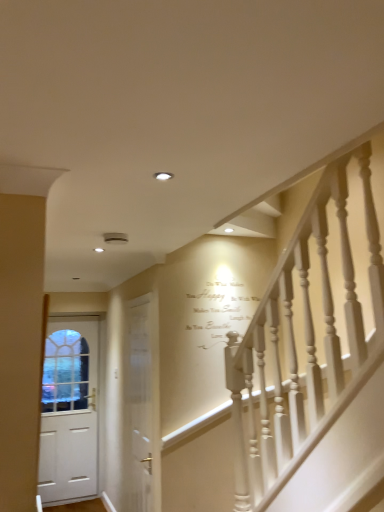
What are the coordinates of `white matte door at left, the 1th door positioned from the back` in the screenshot? It's located at (69, 411).

The height and width of the screenshot is (512, 384). What do you see at coordinates (69, 411) in the screenshot?
I see `white matte door at left, the 2th door in the right-to-left sequence` at bounding box center [69, 411].

What do you see at coordinates (140, 404) in the screenshot?
I see `white wooden door at center, which appears as the first door when viewed from the right` at bounding box center [140, 404].

This screenshot has width=384, height=512. I want to click on white wooden door at center, which is the first door from front to back, so (140, 404).

What are the coordinates of `white matte door at left, which is the 2th door from front to back` in the screenshot? It's located at (69, 411).

Between white wooden door at center, which is the first door from front to back, and white matte door at left, the 2th door in the right-to-left sequence, which one appears on the right side from the viewer's perspective?

white wooden door at center, which is the first door from front to back.

Is white wooden door at center, which is the first door from front to back, further to the viewer compared to white matte door at left, the 2th door in the right-to-left sequence?

No, it is in front of white matte door at left, the 2th door in the right-to-left sequence.

Considering the positions of points (133, 438) and (82, 348), is point (133, 438) closer to camera compared to point (82, 348)?

Yes, it is in front of point (82, 348).

From the image's perspective, is white wooden door at center, which appears as the first door when viewed from the right, on top of white matte door at left, the 1th door when ordered from left to right?

Yes.

From a real-world perspective, is white wooden door at center, which ranks as the 2th door in left-to-right order, physically located above or below white matte door at left, which is the 2th door from front to back?

Clearly, from a real-world perspective, white wooden door at center, which ranks as the 2th door in left-to-right order, is above white matte door at left, which is the 2th door from front to back.

Can you confirm if white wooden door at center, which appears as the first door when viewed from the right, is wider than white matte door at left, the 2th door in the right-to-left sequence?

In fact, white wooden door at center, which appears as the first door when viewed from the right, might be narrower than white matte door at left, the 2th door in the right-to-left sequence.

Who is shorter, white wooden door at center, which is the first door from front to back, or white matte door at left, the 1th door when ordered from left to right?

With less height is white wooden door at center, which is the first door from front to back.

Considering the sizes of objects white wooden door at center, which appears as the first door when viewed from the right, and white matte door at left, the 2th door in the right-to-left sequence, in the image provided, who is smaller, white wooden door at center, which appears as the first door when viewed from the right, or white matte door at left, the 2th door in the right-to-left sequence,?

Smaller between the two is white wooden door at center, which appears as the first door when viewed from the right.

Would you say white matte door at left, the 1th door positioned from the back, is part of white wooden door at center, which appears as the first door when viewed from the right,'s contents?

No, white matte door at left, the 1th door positioned from the back, is not inside white wooden door at center, which appears as the first door when viewed from the right.

Is white wooden door at center, which ranks as the 2th door in left-to-right order, far from white matte door at left, the 1th door positioned from the back?

white wooden door at center, which ranks as the 2th door in left-to-right order, is positioned a significant distance from white matte door at left, the 1th door positioned from the back.

Does white wooden door at center, the 2th door viewed from the back, turn towards white matte door at left, the 1th door when ordered from left to right?

No, white wooden door at center, the 2th door viewed from the back, is not aimed at white matte door at left, the 1th door when ordered from left to right.

How many degrees apart are the facing directions of white wooden door at center, which is the first door from front to back, and white matte door at left, the 2th door in the right-to-left sequence?

white wooden door at center, which is the first door from front to back, and white matte door at left, the 2th door in the right-to-left sequence, are facing 89.7 degrees away from each other.

Where is `door that is above the white matte door at left, the 1th door when ordered from left to right (from a real-world perspective)`? The width and height of the screenshot is (384, 512). door that is above the white matte door at left, the 1th door when ordered from left to right (from a real-world perspective) is located at coordinates (140, 404).

Which object is positioned more to the right, white matte door at left, which is the 2th door from front to back, or white wooden door at center, which appears as the first door when viewed from the right?

Positioned to the right is white wooden door at center, which appears as the first door when viewed from the right.

Who is more distant, white matte door at left, the 1th door when ordered from left to right, or white wooden door at center, the 2th door viewed from the back?

white matte door at left, the 1th door when ordered from left to right, is further away from the camera.

Which is closer to the camera, (69, 413) or (155, 371)?

The point (155, 371) is closer.

From the image's perspective, is white matte door at left, the 1th door positioned from the back, on white wooden door at center, which is the first door from front to back?

No, from the image's perspective, white matte door at left, the 1th door positioned from the back, is not above white wooden door at center, which is the first door from front to back.

From a real-world perspective, is white matte door at left, the 2th door in the right-to-left sequence, located beneath white wooden door at center, the 2th door viewed from the back?

Yes, from a real-world perspective, white matte door at left, the 2th door in the right-to-left sequence, is below white wooden door at center, the 2th door viewed from the back.

Between white matte door at left, the 2th door in the right-to-left sequence, and white wooden door at center, the 2th door viewed from the back, which one has smaller width?

With smaller width is white wooden door at center, the 2th door viewed from the back.

Which of these two, white matte door at left, the 1th door positioned from the back, or white wooden door at center, the 2th door viewed from the back, stands shorter?

With less height is white wooden door at center, the 2th door viewed from the back.

Based on the photo, is white matte door at left, the 1th door when ordered from left to right, smaller than white wooden door at center, which ranks as the 2th door in left-to-right order?

Incorrect, white matte door at left, the 1th door when ordered from left to right, is not smaller in size than white wooden door at center, which ranks as the 2th door in left-to-right order.

Is white wooden door at center, which is the first door from front to back, a part of white matte door at left, which is the 2th door from front to back?

No.

Is there a large distance between white matte door at left, the 1th door when ordered from left to right, and white wooden door at center, the 2th door viewed from the back?

Absolutely, white matte door at left, the 1th door when ordered from left to right, is distant from white wooden door at center, the 2th door viewed from the back.

Is white matte door at left, the 1th door when ordered from left to right, positioned with its back to white wooden door at center, which is the first door from front to back?

No, white wooden door at center, which is the first door from front to back, is not at the back of white matte door at left, the 1th door when ordered from left to right.

How different are the orientations of white matte door at left, the 1th door when ordered from left to right, and white wooden door at center, which is the first door from front to back, in degrees?

white matte door at left, the 1th door when ordered from left to right, and white wooden door at center, which is the first door from front to back, are facing 89.7 degrees away from each other.

How much distance is there between white matte door at left, the 1th door when ordered from left to right, and white wooden door at center, the 2th door viewed from the back?

white matte door at left, the 1th door when ordered from left to right, and white wooden door at center, the 2th door viewed from the back, are 1.00 meters apart.

You are a GUI agent. You are given a task and a screenshot of the screen. Output one action in this format:
    pyautogui.click(x=<x>, y=<y>)
    Task: Click on the door that is below the white wooden door at center, which is the first door from front to back (from the image's perspective)
    This screenshot has width=384, height=512.
    Given the screenshot: What is the action you would take?
    pyautogui.click(x=69, y=411)

Where is `door lying below the white wooden door at center, which ranks as the 2th door in left-to-right order (from the image's perspective)`? This screenshot has width=384, height=512. door lying below the white wooden door at center, which ranks as the 2th door in left-to-right order (from the image's perspective) is located at coordinates (69, 411).

This screenshot has width=384, height=512. In order to click on door located above the white matte door at left, the 1th door when ordered from left to right (from the image's perspective) in this screenshot , I will do `click(140, 404)`.